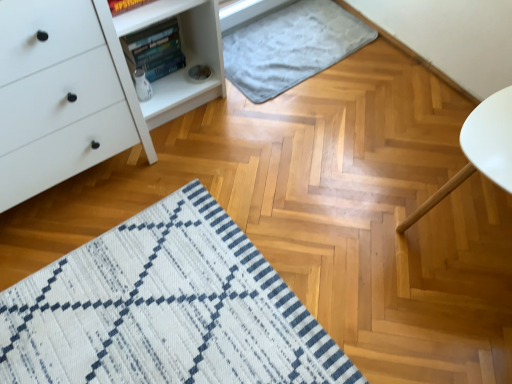
Image resolution: width=512 pixels, height=384 pixels. I want to click on free point behind white matte table at right, so click(411, 127).